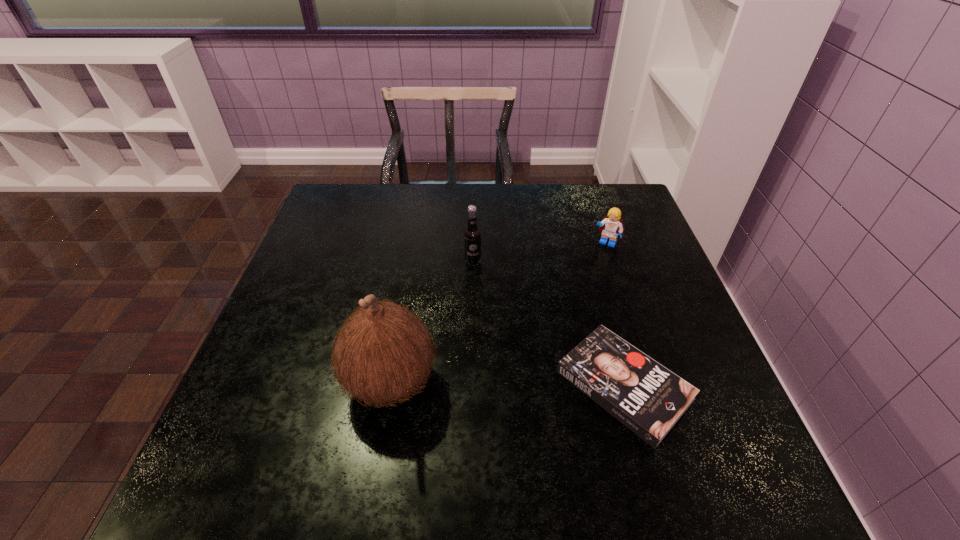
Locate an element on the screen. The width and height of the screenshot is (960, 540). Lego at the right edge is located at coordinates (611, 226).

Image resolution: width=960 pixels, height=540 pixels. I want to click on object positioned at the near right corner, so click(645, 396).

The image size is (960, 540). I want to click on free region at the far edge of the desktop, so click(x=438, y=186).

In the image, there is a desktop. In order to click on vacant space at the near edge in this screenshot , I will do point(575,399).

In the image, there is a desktop. Where is `free space at the left edge`? free space at the left edge is located at coordinates (333, 233).

This screenshot has height=540, width=960. I want to click on free space at the right edge of the desktop, so [x=619, y=277].

At what (x,y) coordinates should I click in order to perform the action: click on free space at the far left corner. Please return your answer as a coordinate pair (x, y). The width and height of the screenshot is (960, 540). Looking at the image, I should click on (346, 185).

This screenshot has width=960, height=540. In the image, there is a desktop. Find the location of `vacant space at the far right corner`. vacant space at the far right corner is located at coordinates (627, 221).

In order to click on blank region between the leftmost object and the second tallest object in this screenshot , I will do `click(432, 321)`.

Locate an element on the screen. This screenshot has width=960, height=540. blank region between the second farthest object and the third tallest object is located at coordinates (540, 252).